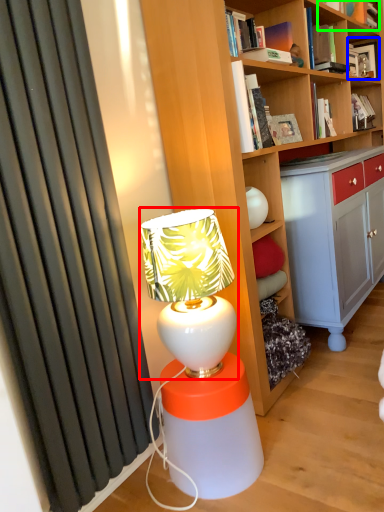
Question: Which object is the farthest from table lamp (highlighted by a red box)? Choose among these: book (highlighted by a blue box) or book (highlighted by a green box).

Choices:
 (A) book
 (B) book

Answer: (A)